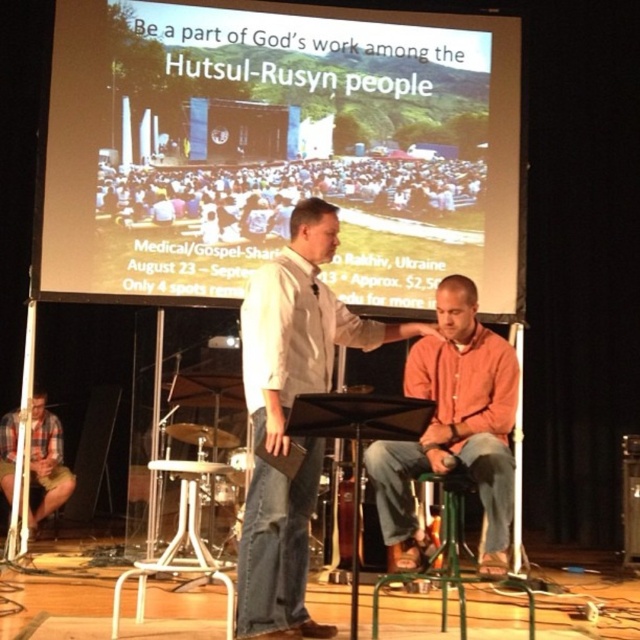
You are an event organizer observing the scene. Which of the two men at center is closer to you, the one wearing the white shirt at center or the one in the orange cotton shirt at center?

The white shirt at center is in front of the orange cotton shirt at center, so the man wearing the white shirt at center is closer to you.